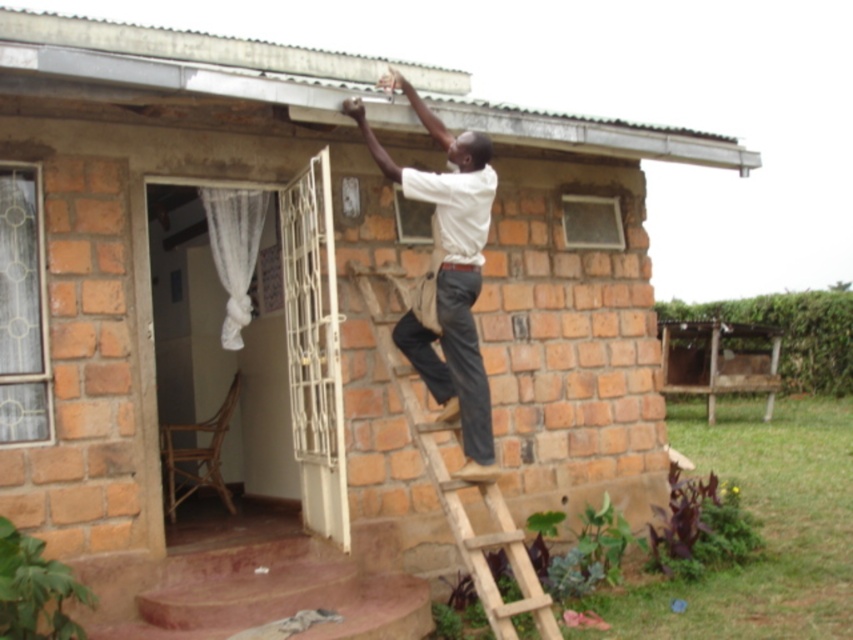
Between white shirt at upper center and white sheer curtain at left, which one has more height?

white shirt at upper center is taller.

Does white shirt at upper center have a greater height compared to white sheer curtain at left?

Yes, white shirt at upper center is taller than white sheer curtain at left.

Between point (485, 157) and point (199, 189), which one is positioned behind?

The point (199, 189) is more distant.

What are the coordinates of `white shirt at upper center` in the screenshot? It's located at (448, 273).

Is white shirt at upper center above wooden at right?

Yes.

Does white shirt at upper center appear under wooden at right?

Actually, white shirt at upper center is above wooden at right.

The image size is (853, 640). I want to click on white shirt at upper center, so click(448, 273).

Does wooden at right have a lesser width compared to white sheer curtain at left?

Incorrect, wooden at right's width is not less than white sheer curtain at left's.

Which is behind, point (469, 540) or point (215, 218)?

Positioned behind is point (215, 218).

Find the location of a particular element. wooden at right is located at coordinates (457, 483).